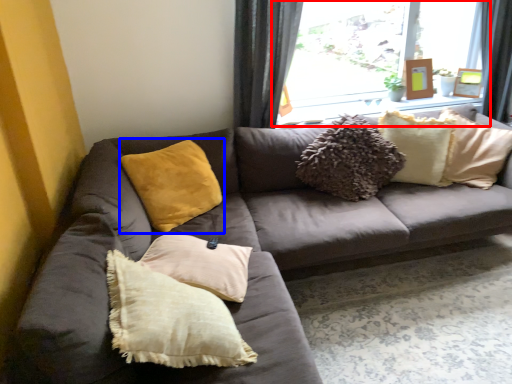
Question: Which object is closer to the camera taking this photo, window (highlighted by a red box) or pillow (highlighted by a blue box)?

Choices:
 (A) window
 (B) pillow

Answer: (B)